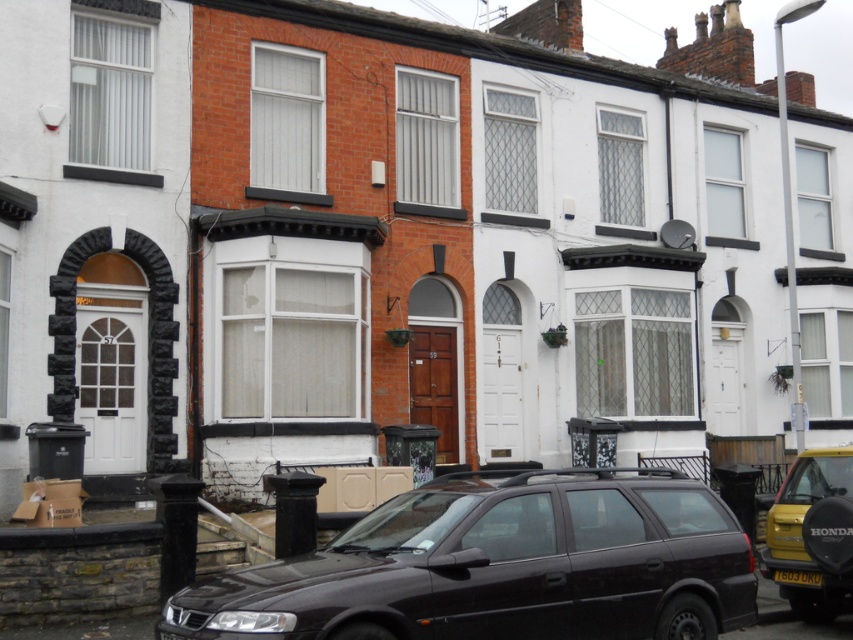
Question: Which point is farther from the camera taking this photo?

Choices:
 (A) (834, 477)
 (B) (778, 576)

Answer: (A)

Question: Does matte black car at center have a larger size compared to yellow matte van at lower right?

Choices:
 (A) no
 (B) yes

Answer: (B)

Question: Which of the following is the farthest from the observer?

Choices:
 (A) matte black car at center
 (B) yellow matte van at lower right
 (C) yellow plastic license plate at lower center

Answer: (C)

Question: Which is nearer to the matte black car at center?

Choices:
 (A) yellow plastic license plate at lower center
 (B) yellow matte van at lower right

Answer: (B)

Question: Does matte black car at center have a greater width compared to yellow matte van at lower right?

Choices:
 (A) no
 (B) yes

Answer: (B)

Question: Is matte black car at center above yellow matte van at lower right?

Choices:
 (A) yes
 (B) no

Answer: (A)